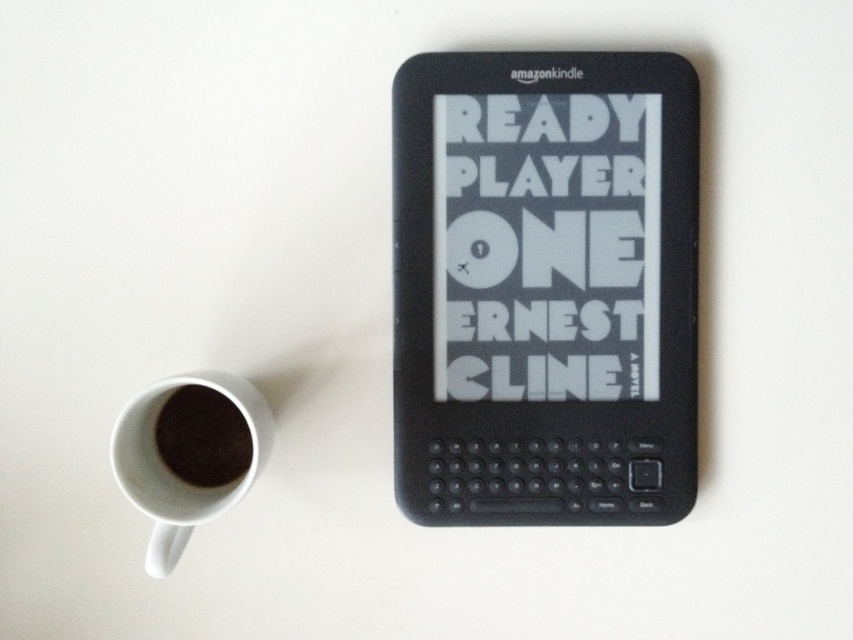
Is black matte e-reader at center thinner than white ceramic mug at lower left?

Incorrect, black matte e-reader at center's width is not less than white ceramic mug at lower left's.

Locate an element on the screen. The width and height of the screenshot is (853, 640). black matte e-reader at center is located at coordinates (544, 288).

Identify the location of black matte e-reader at center. The image size is (853, 640). (544, 288).

Between black matte e-reader at center and dark matte coffee cup at lower left, which one is positioned higher?

black matte e-reader at center is higher up.

Image resolution: width=853 pixels, height=640 pixels. Describe the element at coordinates (544, 288) in the screenshot. I see `black matte e-reader at center` at that location.

Locate an element on the screen. This screenshot has width=853, height=640. black matte e-reader at center is located at coordinates (544, 288).

Can you confirm if white ceramic mug at lower left is bigger than dark matte coffee cup at lower left?

Yes, white ceramic mug at lower left is bigger than dark matte coffee cup at lower left.

Is white ceramic mug at lower left thinner than dark matte coffee cup at lower left?

In fact, white ceramic mug at lower left might be wider than dark matte coffee cup at lower left.

The image size is (853, 640). What are the coordinates of `white ceramic mug at lower left` in the screenshot? It's located at (171, 472).